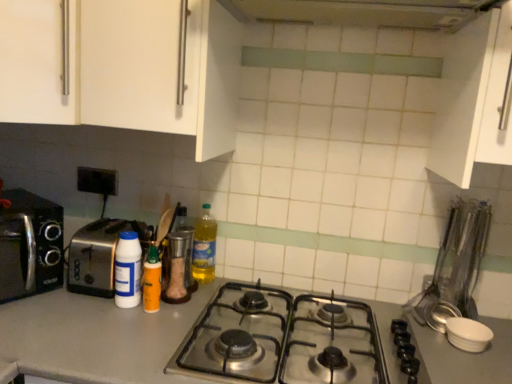
Where is `vacant point to the right of orange matte squeeze bottle at center, the second bottle viewed from the left`? vacant point to the right of orange matte squeeze bottle at center, the second bottle viewed from the left is located at coordinates (181, 308).